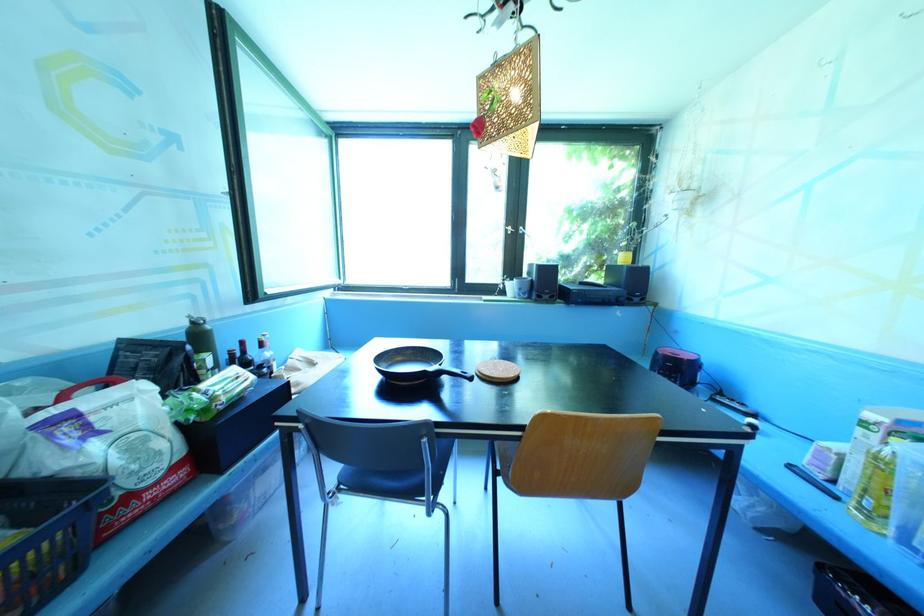
Describe the element at coordinates (509, 228) in the screenshot. This screenshot has height=616, width=924. I see `the black window handle` at that location.